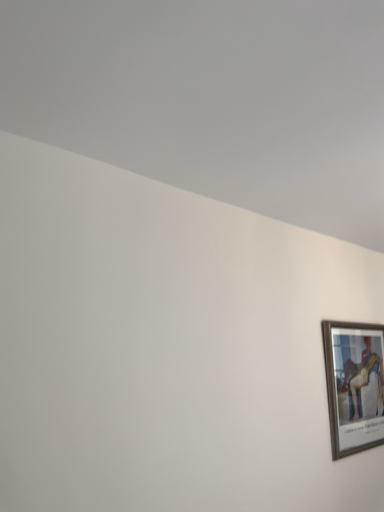
Image resolution: width=384 pixels, height=512 pixels. What do you see at coordinates (354, 387) in the screenshot? I see `wooden picture frame at lower right` at bounding box center [354, 387].

Identify the location of wooden picture frame at lower right. (354, 387).

Based on the photo, measure the distance between wooden picture frame at lower right and camera.

A distance of 2.25 meters exists between wooden picture frame at lower right and camera.

The width and height of the screenshot is (384, 512). I want to click on wooden picture frame at lower right, so click(x=354, y=387).